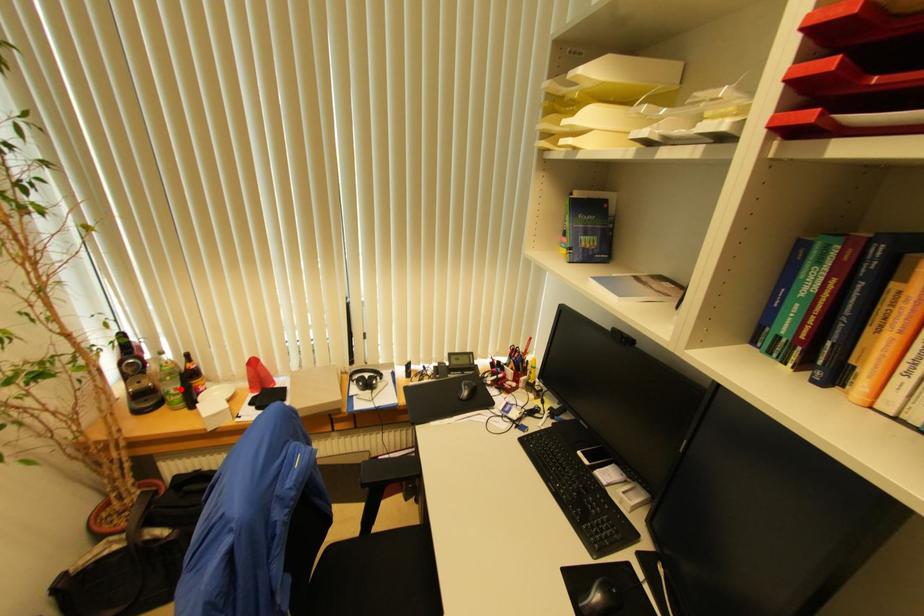
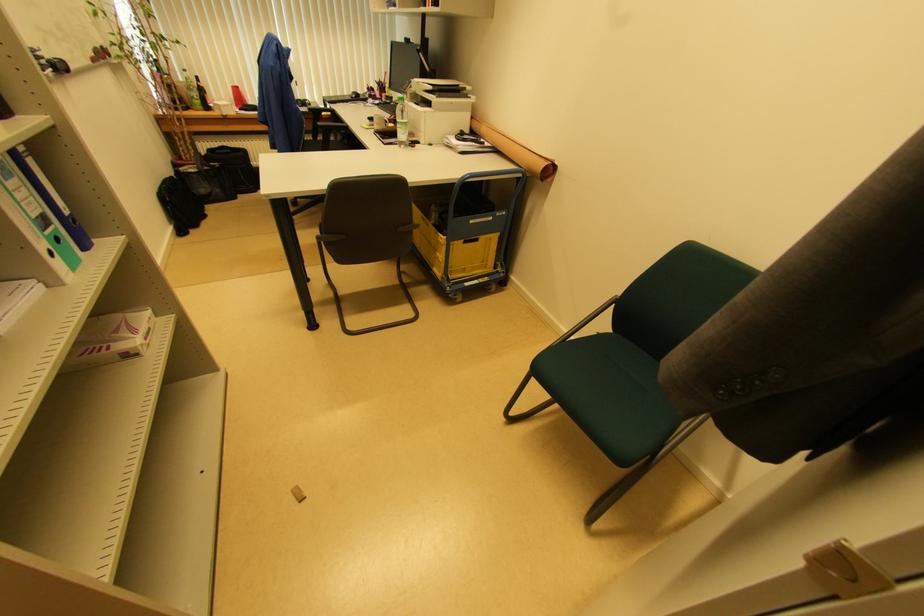
Question: I am providing you with two images of the same scene from different viewpoints. A red point is shown in image1. For the corresponding object point in image2, is it positioned nearer or farther from the camera?

Choices:
 (A) Nearer
 (B) Farther

Answer: (B)